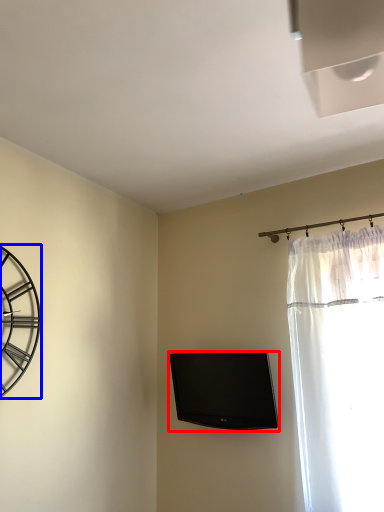
Question: Which point is further to the camera, television (highlighted by a red box) or wall clock (highlighted by a blue box)?

Choices:
 (A) television
 (B) wall clock

Answer: (A)